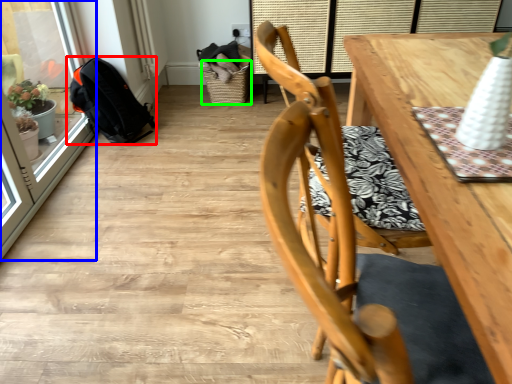
Question: Estimate the real-world distances between objects in this image. Which object is farther from backpack (highlighted by a red box), screen door (highlighted by a blue box) or basket (highlighted by a green box)?

Choices:
 (A) screen door
 (B) basket

Answer: (B)